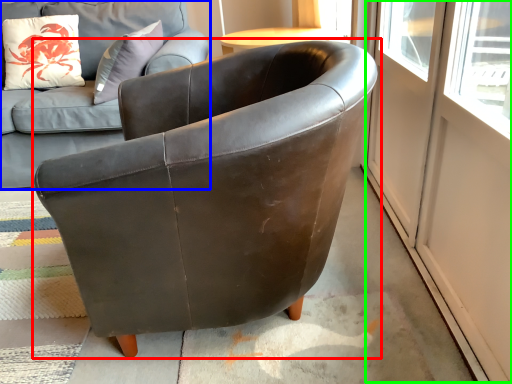
Question: Based on their relative distances, which object is nearer to chair (highlighted by a red box)? Choose from studio couch (highlighted by a blue box) and screen door (highlighted by a green box).

Choices:
 (A) studio couch
 (B) screen door

Answer: (B)